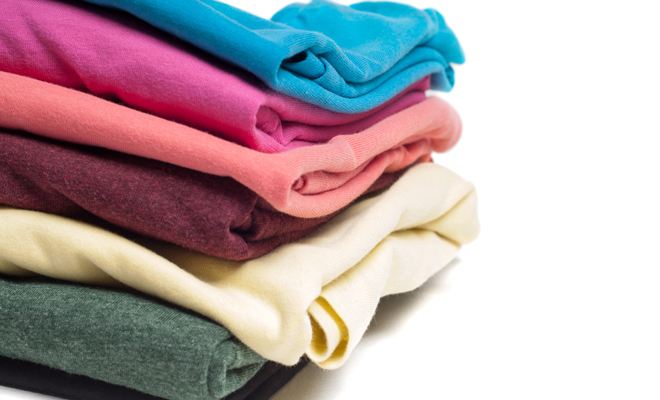
Find the location of a particular element. The width and height of the screenshot is (660, 400). folded garments is located at coordinates (305, 62), (257, 102), (288, 172), (220, 214), (308, 288), (201, 358), (269, 382).